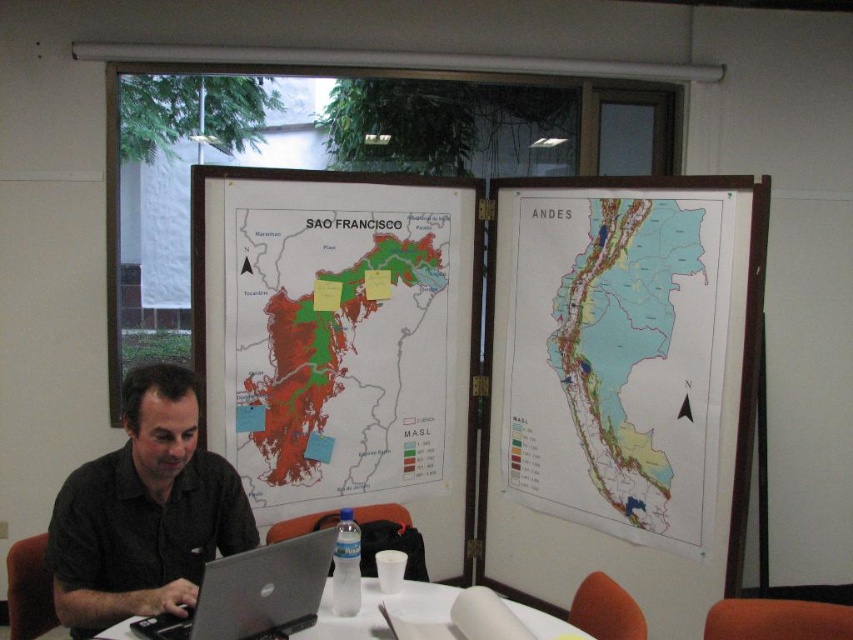
Who is shorter, green matte map at center or light blue paper map at center right?

Standing shorter between the two is green matte map at center.

Which is more to the left, green matte map at center or light blue paper map at center right?

Positioned to the left is green matte map at center.

Is point (233, 260) positioned behind point (619, 387)?

No, (233, 260) is in front of (619, 387).

Identify the location of green matte map at center. The image size is (853, 640). (340, 340).

In the scene shown: Does green matte map at center have a smaller size compared to black matte shirt at center?

No, green matte map at center is not smaller than black matte shirt at center.

Is green matte map at center below black matte shirt at center?

Actually, green matte map at center is above black matte shirt at center.

Locate an element on the screen. This screenshot has height=640, width=853. green matte map at center is located at coordinates (340, 340).

From the picture: Who is more forward, (x=676, y=432) or (x=556, y=636)?

Point (x=556, y=636) is more forward.

What do you see at coordinates (614, 356) in the screenshot?
I see `light blue paper map at center right` at bounding box center [614, 356].

Measure the distance between light blue paper map at center right and camera.

They are 2.51 meters apart.

Locate an element on the screen. This screenshot has height=640, width=853. light blue paper map at center right is located at coordinates [614, 356].